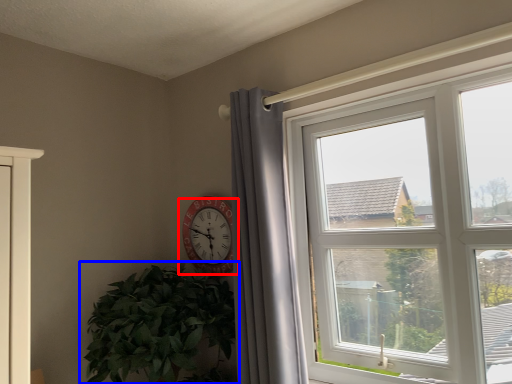
Question: Which object appears closest to the camera in this image, wall clock (highlighted by a red box) or houseplant (highlighted by a blue box)?

Choices:
 (A) wall clock
 (B) houseplant

Answer: (B)